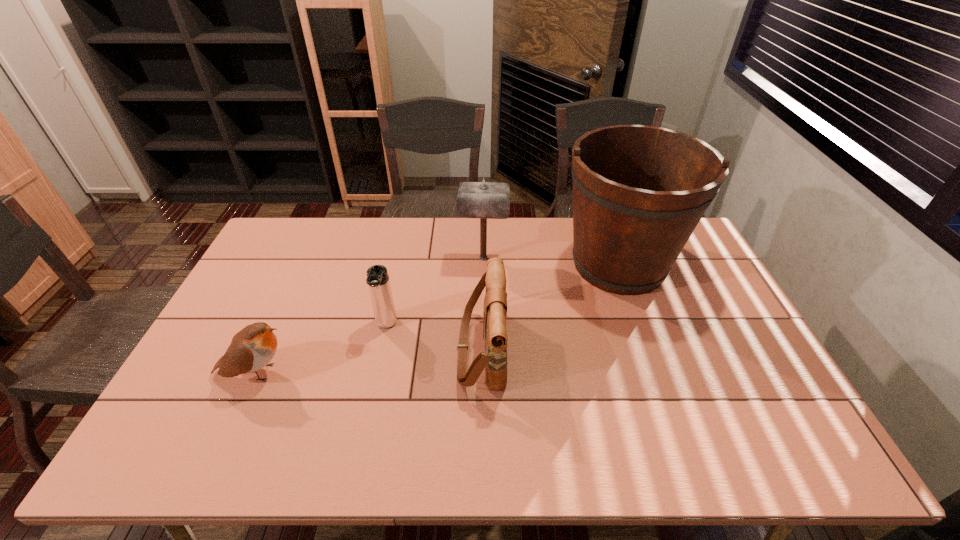
In the image, there is a desktop. Identify the location of free region at the left edge. (254, 295).

Where is `blank space at the right edge`? This screenshot has width=960, height=540. blank space at the right edge is located at coordinates (730, 310).

You are a GUI agent. You are given a task and a screenshot of the screen. Output one action in this format:
    pyautogui.click(x=<x>, y=<y>)
    Task: Click on the free space between the bucket and the shoulder bag
    The width and height of the screenshot is (960, 540).
    Given the screenshot: What is the action you would take?
    pyautogui.click(x=550, y=307)

Locate an element on the screen. free spot between the leftmost object and the shoulder bag is located at coordinates click(369, 361).

Locate an element on the screen. empty space that is in between the thermos bottle and the fourth shortest object is located at coordinates (435, 292).

The width and height of the screenshot is (960, 540). Identify the location of blank region between the shoulder bag and the bird. (369, 361).

I want to click on vacant region between the bird and the thermos bottle, so click(x=321, y=349).

Identify the location of free spot between the leftmost object and the thermos bottle. (321, 349).

The image size is (960, 540). I want to click on free point between the rightmost object and the leftmost object, so click(437, 319).

Identify the location of free space that is in between the tallest object and the leftmost object. The width and height of the screenshot is (960, 540). [437, 319].